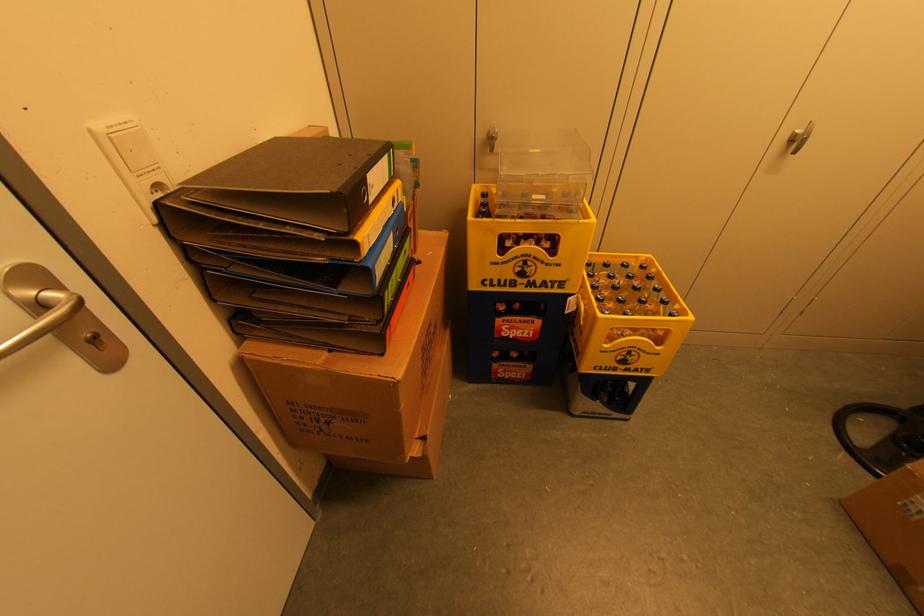
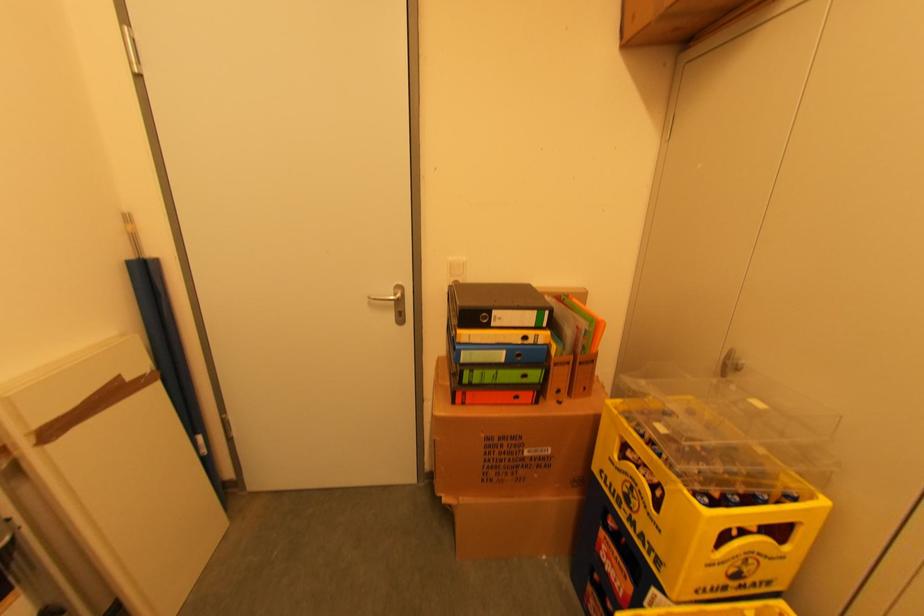
Question: The camera is either moving clockwise (left) or counter-clockwise (right) around the object. The first image is from the beginning of the video and the second image is from the end. Is the camera moving left or right when shooting the video?

Choices:
 (A) Left
 (B) Right

Answer: (B)